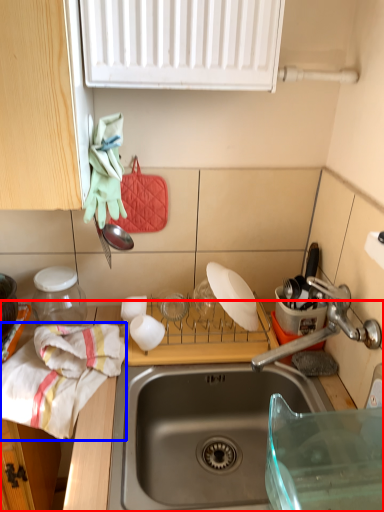
Question: Which of the following is the closest to the observer, countertop (highlighted by a red box) or material (highlighted by a blue box)?

Choices:
 (A) countertop
 (B) material

Answer: (A)